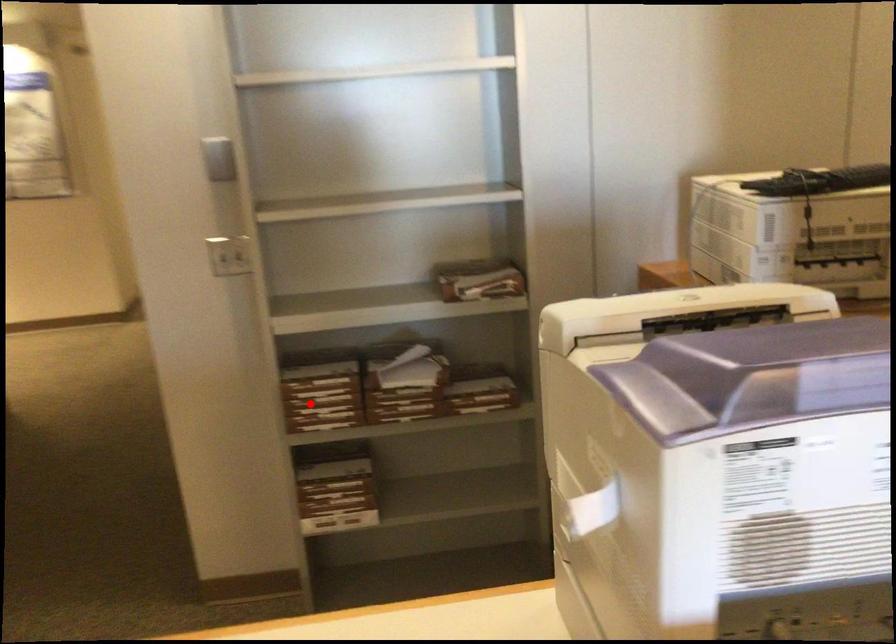
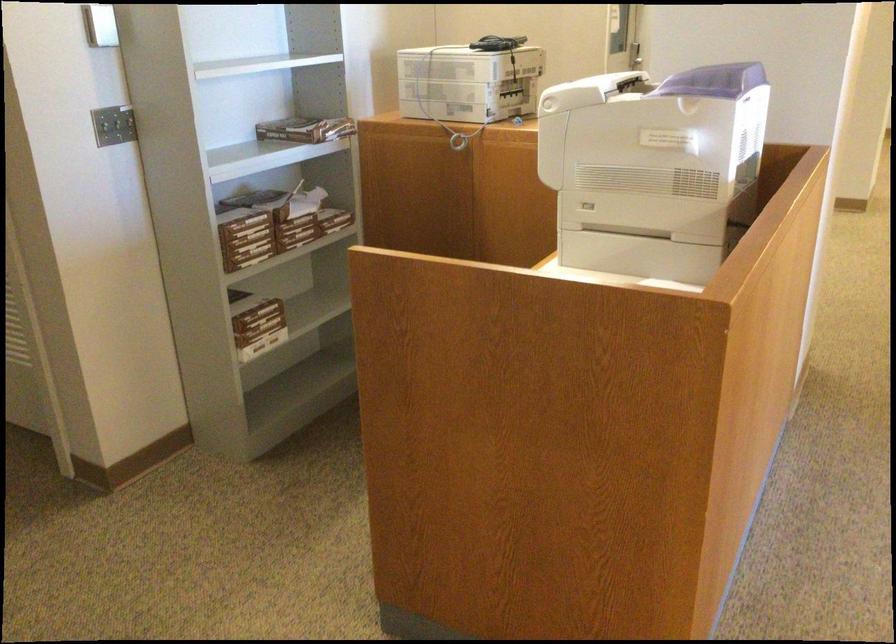
In the second image, find the point that corresponds to the highlighted location in the first image.

(246, 237)